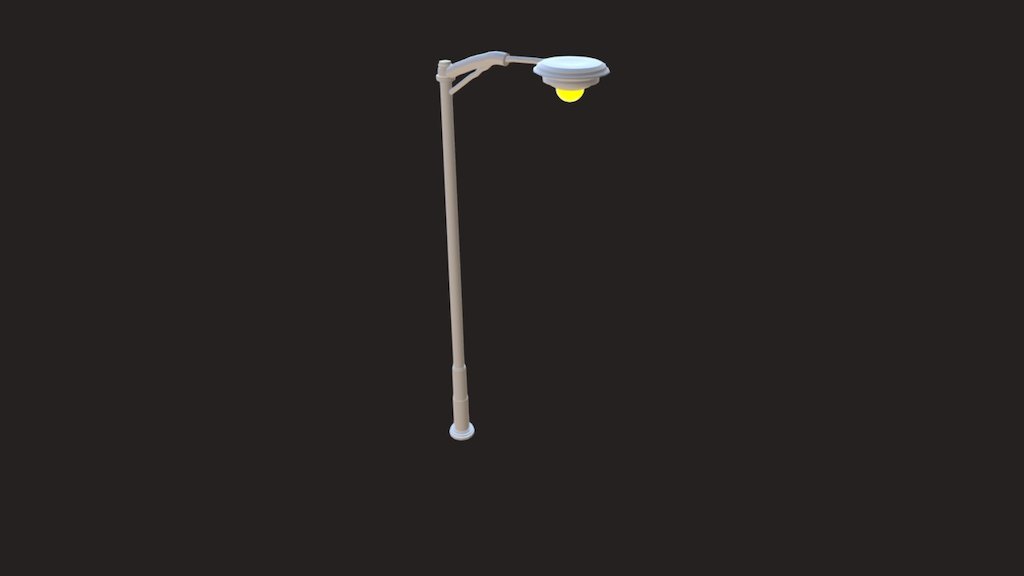
At what (x,y) coordinates should I click in order to perform the action: click on light fixture. Please return your answer as a coordinate pair (x, y). Looking at the image, I should click on (562, 79).